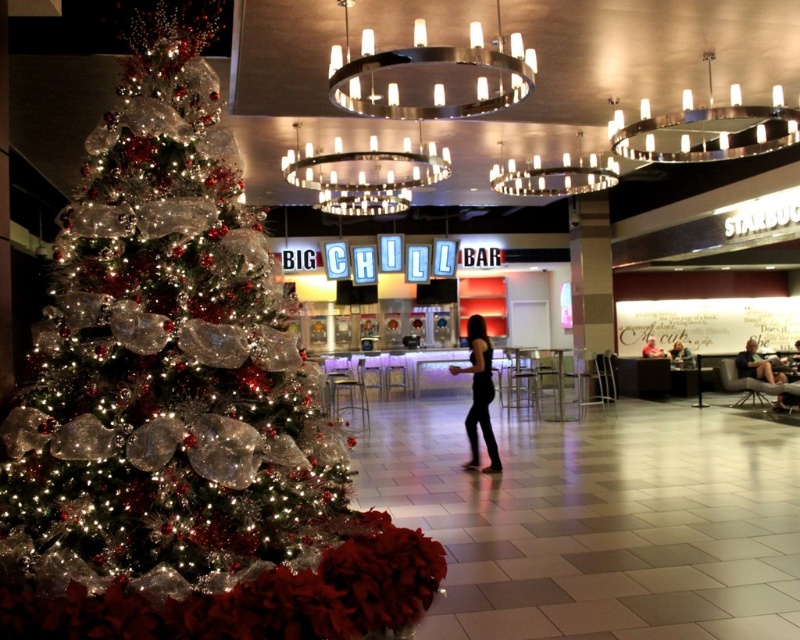
You are a fashion designer who wants to display a matte black dress at lower right and a black leather chair at center in your new collection. Which item is taller?

The matte black dress at lower right is taller than the black leather chair at center.